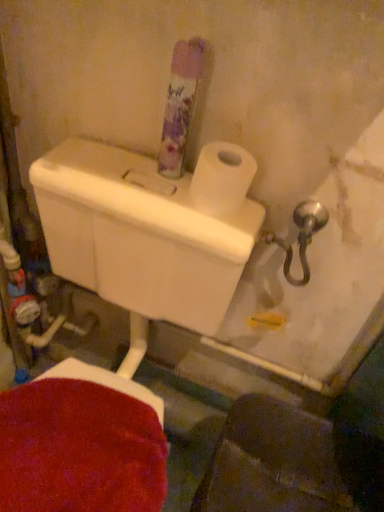
Question: Is white matte toilet paper at upper right further to camera compared to translucent floral-patterned air freshener at upper center?

Choices:
 (A) yes
 (B) no

Answer: (A)

Question: Does white matte toilet paper at upper right touch translucent floral-patterned air freshener at upper center?

Choices:
 (A) no
 (B) yes

Answer: (B)

Question: Is white matte toilet paper at upper right thinner than translucent floral-patterned air freshener at upper center?

Choices:
 (A) no
 (B) yes

Answer: (A)

Question: From a real-world perspective, does white matte toilet paper at upper right stand above translucent floral-patterned air freshener at upper center?

Choices:
 (A) yes
 (B) no

Answer: (B)

Question: Is white matte toilet paper at upper right outside of translucent floral-patterned air freshener at upper center?

Choices:
 (A) yes
 (B) no

Answer: (A)

Question: Does white matte toilet paper at upper right have a lesser height compared to translucent floral-patterned air freshener at upper center?

Choices:
 (A) yes
 (B) no

Answer: (A)

Question: Considering the relative sizes of translucent floral-patterned air freshener at upper center and white matte toilet paper at upper right in the image provided, is translucent floral-patterned air freshener at upper center smaller than white matte toilet paper at upper right?

Choices:
 (A) no
 (B) yes

Answer: (A)

Question: Does translucent floral-patterned air freshener at upper center appear on the left side of white matte toilet paper at upper right?

Choices:
 (A) yes
 (B) no

Answer: (A)

Question: Is translucent floral-patterned air freshener at upper center at the right side of white matte toilet paper at upper right?

Choices:
 (A) no
 (B) yes

Answer: (A)

Question: Does translucent floral-patterned air freshener at upper center have a greater width compared to white matte toilet paper at upper right?

Choices:
 (A) no
 (B) yes

Answer: (A)

Question: From a real-world perspective, does translucent floral-patterned air freshener at upper center stand above white matte toilet paper at upper right?

Choices:
 (A) yes
 (B) no

Answer: (A)

Question: Is translucent floral-patterned air freshener at upper center shorter than white matte toilet paper at upper right?

Choices:
 (A) no
 (B) yes

Answer: (A)

Question: From the image's perspective, is translucent floral-patterned air freshener at upper center positioned above or below white matte toilet paper at upper right?

Choices:
 (A) below
 (B) above

Answer: (B)